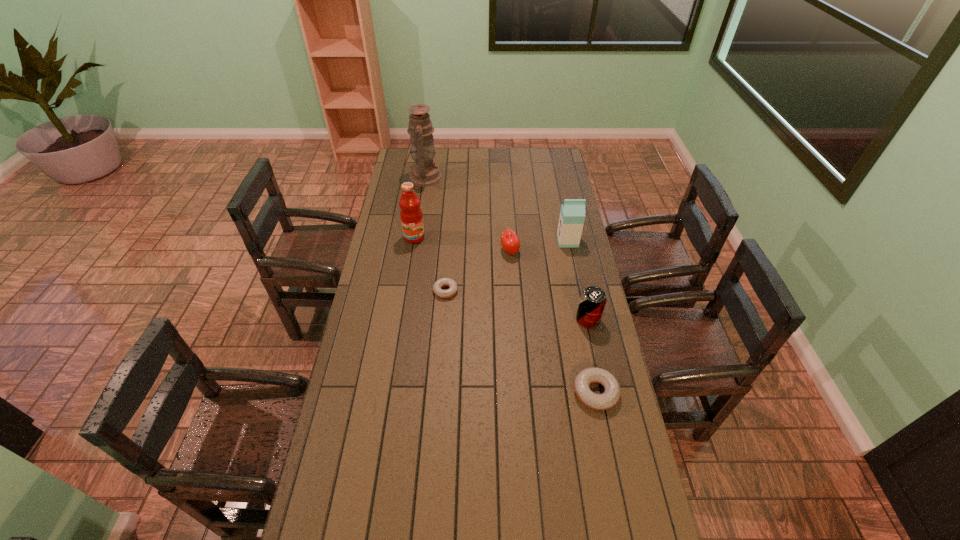
The image size is (960, 540). Identify the location of the third object from left to right. (452, 285).

The width and height of the screenshot is (960, 540). Identify the location of the shortest object. (452, 285).

Where is `the nearer doughnut`? the nearer doughnut is located at coordinates (611, 395).

Where is `the nearest object`? the nearest object is located at coordinates coord(611,395).

At what (x,y) coordinates should I click in order to perform the action: click on the fourth object from right to left. Please return your answer as a coordinate pair (x, y). Looking at the image, I should click on (510, 242).

Where is `apple`? This screenshot has height=540, width=960. apple is located at coordinates (510, 242).

The image size is (960, 540). I want to click on the tallest object, so click(424, 173).

This screenshot has width=960, height=540. Identify the location of oil lamp. (424, 173).

At what (x,y) coordinates should I click in order to perform the action: click on fruit juice. Please return your answer as a coordinate pair (x, y). The height and width of the screenshot is (540, 960). Looking at the image, I should click on (411, 216).

The image size is (960, 540). What are the coordinates of `the fourth tallest object` in the screenshot? It's located at (593, 299).